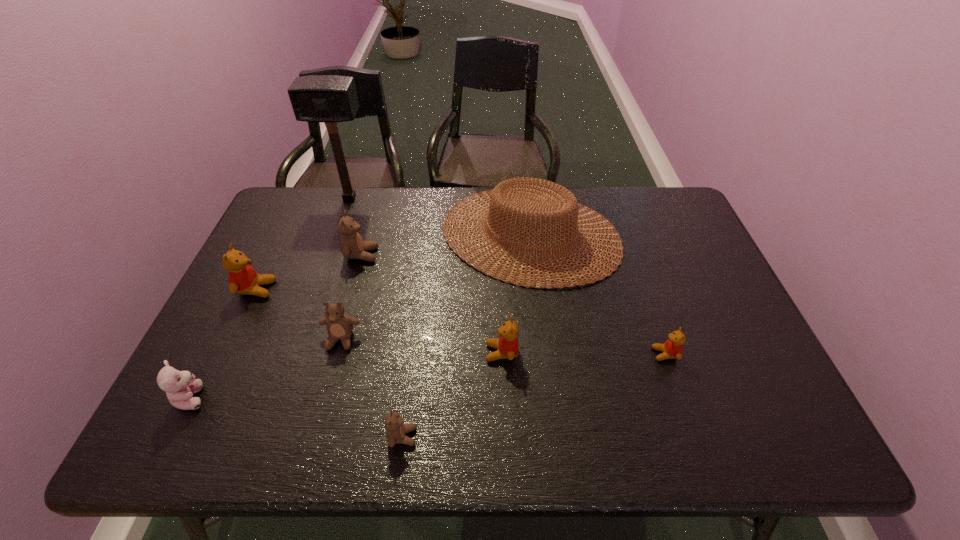
Locate an element on the screen. free space between the second teddy bear from right to left and the tallest object is located at coordinates (425, 275).

This screenshot has width=960, height=540. Find the location of `free space between the rightmost brown teddy bear and the biggest red teddy bear`. free space between the rightmost brown teddy bear and the biggest red teddy bear is located at coordinates click(329, 363).

Identify the location of free space that is in between the sunhat and the farthest red teddy bear. (394, 262).

The image size is (960, 540). I want to click on vacant space that is in between the sixth teddy bear from left to right and the tallest object, so click(x=425, y=275).

Find the location of `vacant area between the second teddy bear from right to left and the beige sunhat`. vacant area between the second teddy bear from right to left and the beige sunhat is located at coordinates (516, 294).

This screenshot has width=960, height=540. I want to click on free space between the nearest teddy bear and the smallest red teddy bear, so click(534, 395).

Image resolution: width=960 pixels, height=540 pixels. Identify the location of free spot between the second smallest brown teddy bear and the second nearest teddy bear. (267, 368).

Image resolution: width=960 pixels, height=540 pixels. I want to click on free point between the biggest red teddy bear and the pink teddy bear, so click(x=225, y=343).

I want to click on vacant space in between the second nearest teddy bear and the farthest teddy bear, so click(276, 326).

Identify the location of object that stands as the seventh closest to the rightmost red teddy bear. This screenshot has width=960, height=540. (243, 279).